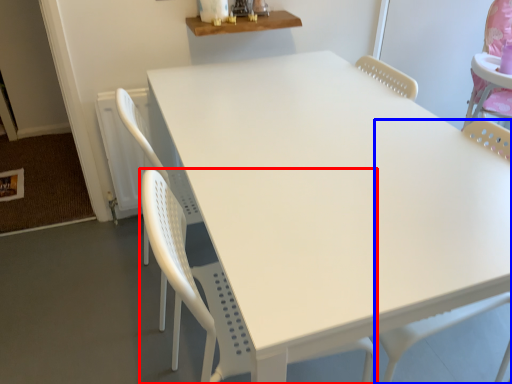
Question: Which point is further to the camera, chair (highlighted by a red box) or swivel chair (highlighted by a blue box)?

Choices:
 (A) chair
 (B) swivel chair

Answer: (B)